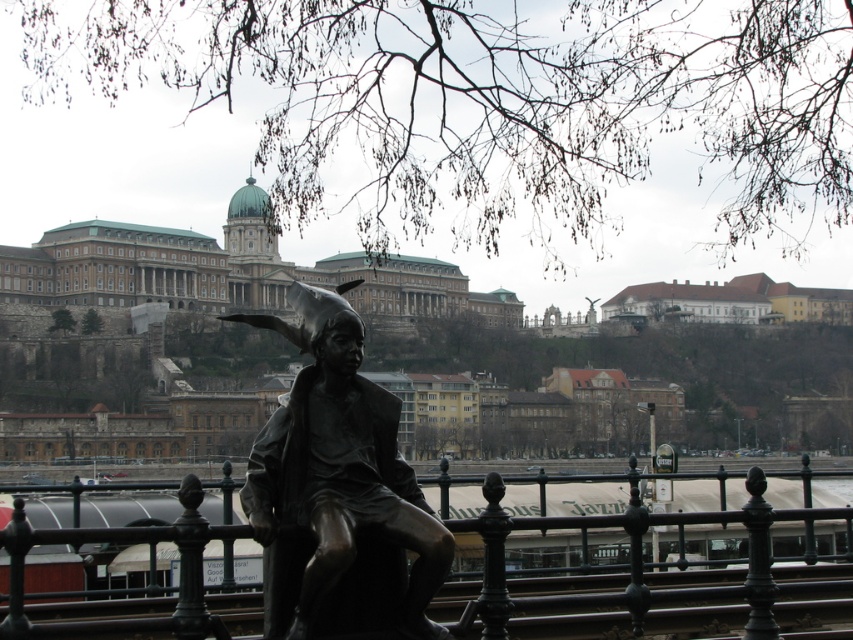
Based on the photo, you are a tourist standing in front of the bronze statue at center and the brown stone palace at upper center. Which object is larger in size?

The bronze statue at center has a smaller size compared to the brown stone palace at upper center, so the brown stone palace at upper center is larger in size.

Consider the image. You are a tourist standing in front of the historic building with the green dome. You notice the bronze statue at center and the bronze metal rail at center. Which object is shorter?

The bronze statue at center is shorter than the bronze metal rail at center.